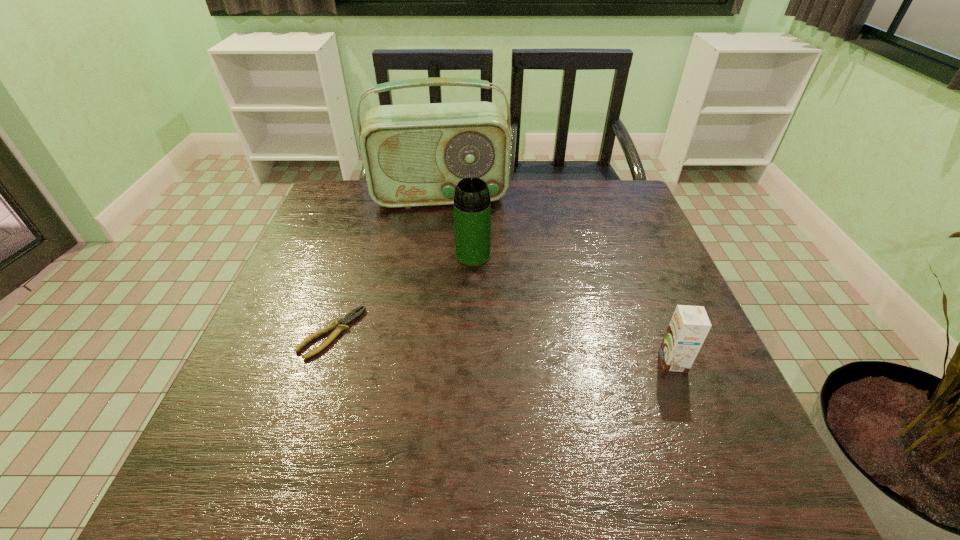
At what (x,y) coordinates should I click in order to perform the action: click on vacant space at the far edge. Please return your answer as a coordinate pair (x, y). Image resolution: width=960 pixels, height=540 pixels. Looking at the image, I should click on (453, 222).

The width and height of the screenshot is (960, 540). Find the location of `vacant space at the near edge of the desktop`. vacant space at the near edge of the desktop is located at coordinates (381, 396).

Identify the location of free space at the left edge of the desktop. This screenshot has height=540, width=960. (345, 252).

Image resolution: width=960 pixels, height=540 pixels. In order to click on vacant space at the right edge in this screenshot , I will do `click(609, 227)`.

In the image, there is a desktop. Where is `vacant area at the far left corner`? This screenshot has height=540, width=960. vacant area at the far left corner is located at coordinates (330, 212).

In order to click on free space at the near left corner of the desktop in this screenshot , I will do `click(232, 396)`.

I want to click on free space at the near right corner of the desktop, so click(x=688, y=410).

At what (x,y) coordinates should I click in order to perform the action: click on vacant area between the pliers and the third shortest object. Please return your answer as a coordinate pair (x, y). The width and height of the screenshot is (960, 540). Looking at the image, I should click on (402, 294).

You are a GUI agent. You are given a task and a screenshot of the screen. Output one action in this format:
    pyautogui.click(x=<x>, y=<y>)
    Task: Click on the free space between the second farthest object and the pliers
    
    Given the screenshot: What is the action you would take?
    pyautogui.click(x=402, y=294)

The image size is (960, 540). Find the location of `vacant space that is in between the pliers and the third nearest object`. vacant space that is in between the pliers and the third nearest object is located at coordinates click(402, 294).